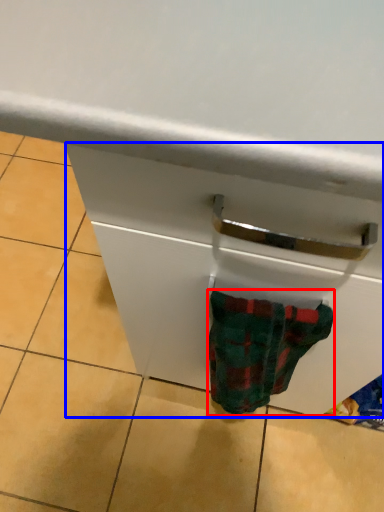
Question: Which point is closer to the camera, sock (highlighted by a red box) or drawer (highlighted by a blue box)?

Choices:
 (A) sock
 (B) drawer

Answer: (A)